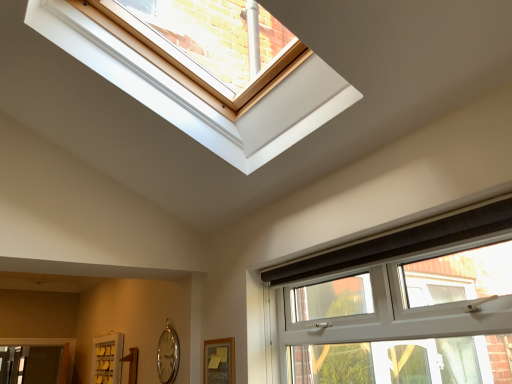
Question: Is silver metallic clock at lower left next to white plastic window at lower right?

Choices:
 (A) no
 (B) yes

Answer: (A)

Question: From the image's perspective, is silver metallic clock at lower left located beneath white plastic window at lower right?

Choices:
 (A) yes
 (B) no

Answer: (A)

Question: Would you say silver metallic clock at lower left is a long distance from white plastic window at lower right?

Choices:
 (A) no
 (B) yes

Answer: (B)

Question: Is silver metallic clock at lower left positioned before white plastic window at lower right?

Choices:
 (A) yes
 (B) no

Answer: (B)

Question: Can you confirm if silver metallic clock at lower left is thinner than white plastic window at lower right?

Choices:
 (A) no
 (B) yes

Answer: (B)

Question: Is white plastic window at lower right inside or outside of silver metallic clock at lower left?

Choices:
 (A) inside
 (B) outside

Answer: (B)

Question: Is white plastic window at lower right taller or shorter than silver metallic clock at lower left?

Choices:
 (A) tall
 (B) short

Answer: (A)

Question: From the image's perspective, relative to silver metallic clock at lower left, is white plastic window at lower right above or below?

Choices:
 (A) above
 (B) below

Answer: (A)

Question: Is white plastic window at lower right to the left or to the right of silver metallic clock at lower left in the image?

Choices:
 (A) right
 (B) left

Answer: (A)

Question: From the image's perspective, is white plastic window at lower right above or below white matte screen door at lower left?

Choices:
 (A) below
 (B) above

Answer: (B)

Question: Would you say white plastic window at lower right is inside or outside white matte screen door at lower left?

Choices:
 (A) outside
 (B) inside

Answer: (A)

Question: Is white plastic window at lower right taller or shorter than white matte screen door at lower left?

Choices:
 (A) tall
 (B) short

Answer: (A)

Question: From a real-world perspective, is white plastic window at lower right above or below white matte screen door at lower left?

Choices:
 (A) below
 (B) above

Answer: (B)

Question: Considering the relative positions of silver metallic clock at lower left and white plastic window at lower right in the image provided, is silver metallic clock at lower left to the left or to the right of white plastic window at lower right?

Choices:
 (A) right
 (B) left

Answer: (B)

Question: Considering the positions of silver metallic clock at lower left and white plastic window at lower right in the image, is silver metallic clock at lower left bigger or smaller than white plastic window at lower right?

Choices:
 (A) small
 (B) big

Answer: (A)